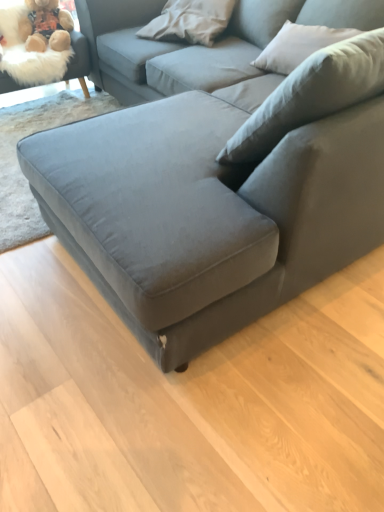
Question: Looking at the image, does velvet gray couch at center seem bigger or smaller compared to fluffy beige swivel chair at upper left?

Choices:
 (A) small
 (B) big

Answer: (B)

Question: Considering their positions, is velvet gray couch at center located in front of or behind fluffy beige swivel chair at upper left?

Choices:
 (A) front
 (B) behind

Answer: (A)

Question: Which is nearer to the white soft pillow at upper center, arranged as the 1th pillow when viewed from the left?

Choices:
 (A) velvet gray couch at center
 (B) light beige fabric pillow at upper right, which is the 2th pillow in left-to-right order
 (C) fluffy beige swivel chair at upper left
 (D) fuzzy beige teddy bear at upper left

Answer: (D)

Question: Which is farther from the fluffy beige swivel chair at upper left?

Choices:
 (A) fuzzy beige teddy bear at upper left
 (B) velvet gray couch at center
 (C) light beige fabric pillow at upper right, the 1th pillow viewed from the right
 (D) white soft pillow at upper center, placed as the second pillow when sorted from right to left

Answer: (C)